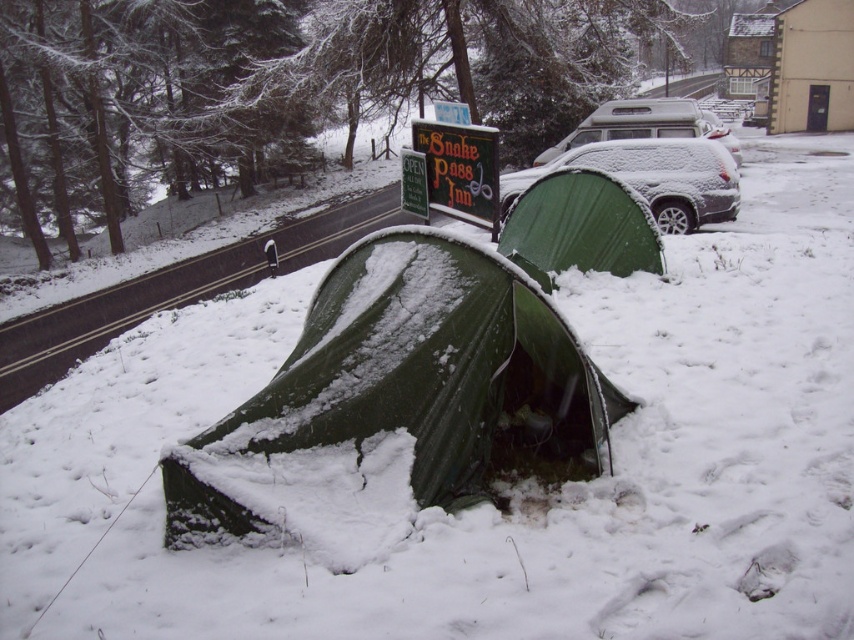
Locate an element on the screen. This screenshot has width=854, height=640. green tarpaulin tent at center is located at coordinates (402, 397).

Is point (537, 340) closer to camera compared to point (616, 221)?

That is True.

Where is `green tarpaulin tent at center`? The width and height of the screenshot is (854, 640). green tarpaulin tent at center is located at coordinates (402, 397).

Can you confirm if green fabric tent at center is positioned above snow-covered suv at upper right?

No.

Does green fabric tent at center have a greater height compared to snow-covered suv at upper right?

No, green fabric tent at center is not taller than snow-covered suv at upper right.

Identify the location of green fabric tent at center. The height and width of the screenshot is (640, 854). (580, 227).

The height and width of the screenshot is (640, 854). Find the location of `green fabric tent at center`. green fabric tent at center is located at coordinates (580, 227).

Consider the image. Does green tarpaulin tent at center have a greater width compared to snow-covered suv at upper right?

Incorrect, green tarpaulin tent at center's width does not surpass snow-covered suv at upper right's.

Can you confirm if green tarpaulin tent at center is taller than snow-covered suv at upper right?

Incorrect, green tarpaulin tent at center's height is not larger of snow-covered suv at upper right's.

Is point (468, 381) closer to viewer compared to point (597, 134)?

Yes, it is in front of point (597, 134).

The height and width of the screenshot is (640, 854). Identify the location of green tarpaulin tent at center. (402, 397).